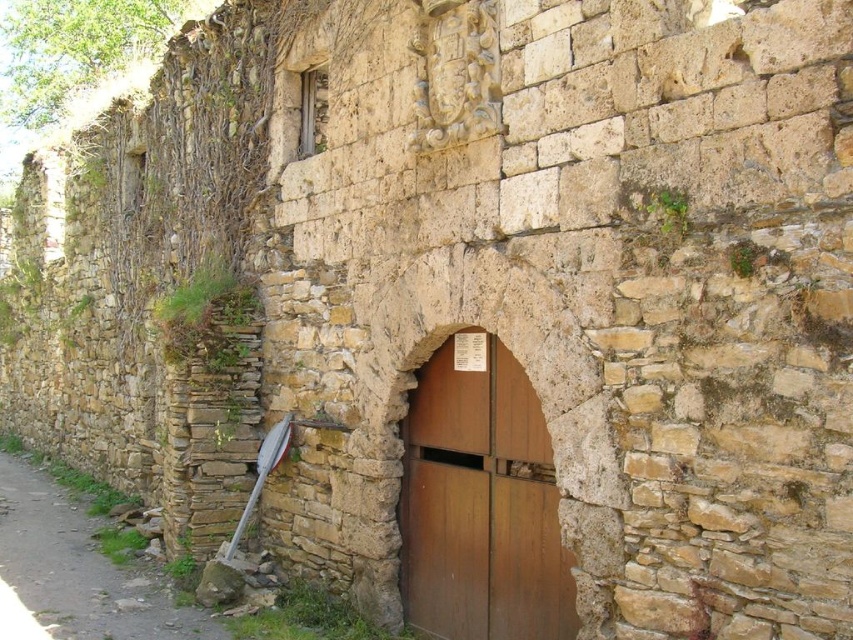
Question: Which point is farther to the camera?

Choices:
 (A) brown wooden door at center
 (B) dirt path at lower left

Answer: (B)

Question: Does brown wooden door at center appear over dirt path at lower left?

Choices:
 (A) yes
 (B) no

Answer: (A)

Question: Which object is closer to the camera taking this photo?

Choices:
 (A) brown wooden door at center
 (B) dirt path at lower left

Answer: (A)

Question: Which point appears farthest from the camera in this image?

Choices:
 (A) (473, 522)
 (B) (140, 602)

Answer: (B)

Question: Is brown wooden door at center smaller than dirt path at lower left?

Choices:
 (A) no
 (B) yes

Answer: (A)

Question: Is brown wooden door at center bigger than dirt path at lower left?

Choices:
 (A) yes
 (B) no

Answer: (A)